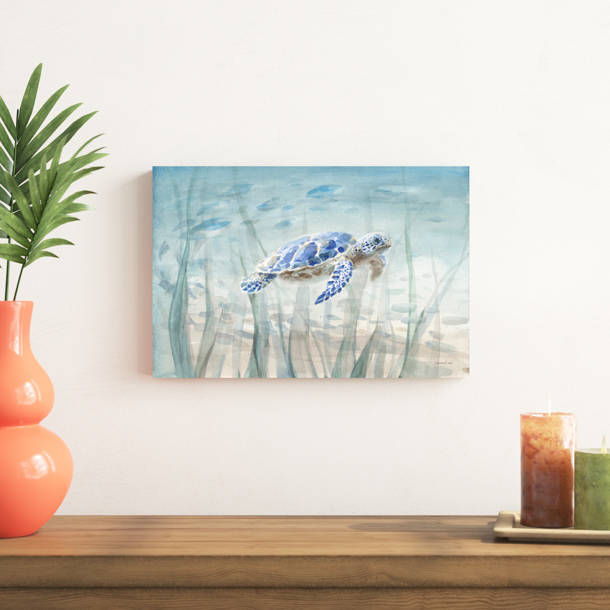
Identify the location of painting. (260, 300).